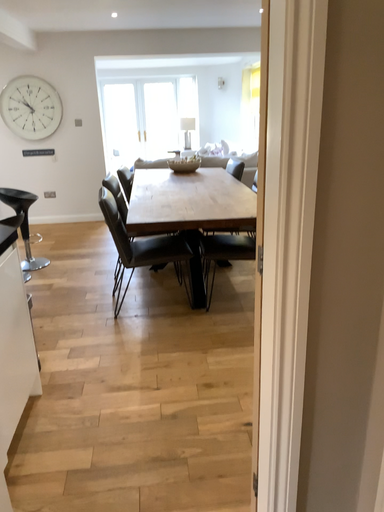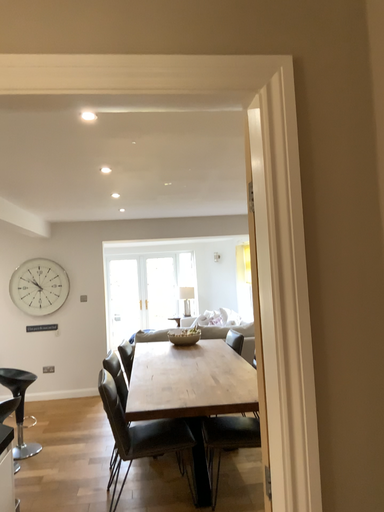
Question: Which way did the camera rotate in the video?

Choices:
 (A) rotated downward
 (B) rotated upward

Answer: (B)